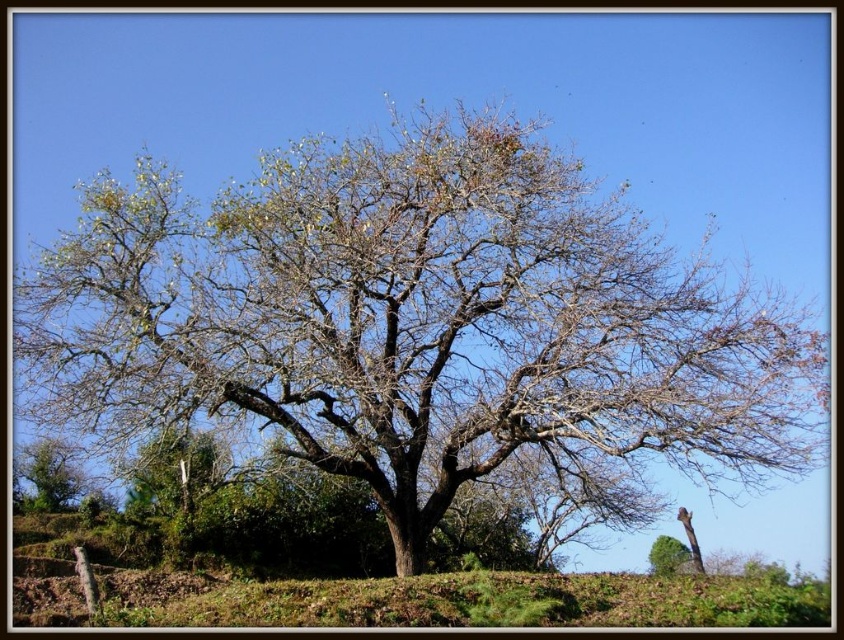
Question: Is brown rough bark tree at center thinner than green leafy tree at lower right?

Choices:
 (A) yes
 (B) no

Answer: (B)

Question: Which point is farther from the camera taking this photo?

Choices:
 (A) (15, 472)
 (B) (387, 604)

Answer: (A)

Question: Which point is farther to the camera?

Choices:
 (A) green leafy tree at lower left
 (B) brown soil at center

Answer: (A)

Question: Observing the image, what is the correct spatial positioning of brown soil at center in reference to green leafy tree at lower left?

Choices:
 (A) below
 (B) above

Answer: (A)

Question: Estimate the real-world distances between objects in this image. Which object is farther from the green leafy tree at lower left?

Choices:
 (A) green leafy tree at lower right
 (B) brown rough bark tree at center
 (C) brown soil at center

Answer: (A)

Question: Is brown soil at center positioned in front of green leafy tree at lower right?

Choices:
 (A) no
 (B) yes

Answer: (B)